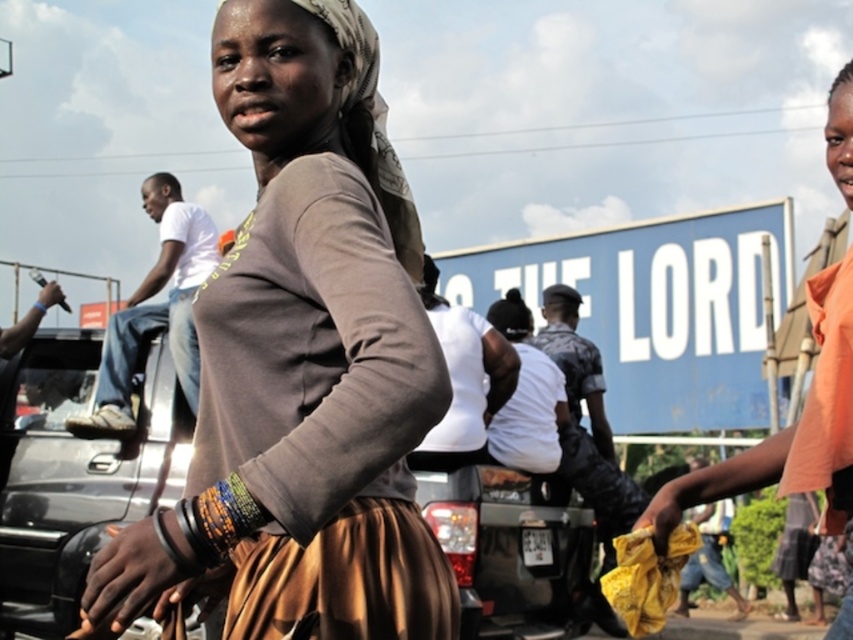
Which of these two, brown matte shirt at center or metallic gray car at center, stands shorter?

With less height is brown matte shirt at center.

Is point (386, 202) positioned after point (15, 513)?

No, (386, 202) is in front of (15, 513).

Where is `brown matte shirt at center`? This screenshot has height=640, width=853. brown matte shirt at center is located at coordinates (303, 362).

Identify the location of brown matte shirt at center. (303, 362).

Which is more to the right, brown matte shirt at center or white matte shirt at center?

white matte shirt at center

This screenshot has height=640, width=853. I want to click on brown matte shirt at center, so click(303, 362).

Is the position of brown matte shirt at center less distant than that of white cotton shirt at left?

Yes, brown matte shirt at center is closer to the viewer.

Is point (426, 552) farther from camera compared to point (164, 268)?

No, (426, 552) is closer to viewer.

Which is behind, point (364, 493) or point (136, 308)?

Point (136, 308)

You are a GUI agent. You are given a task and a screenshot of the screen. Output one action in this format:
    pyautogui.click(x=<x>, y=<y>)
    Task: Click on the brown matte shirt at center
    This screenshot has width=853, height=640.
    Given the screenshot: What is the action you would take?
    pyautogui.click(x=303, y=362)